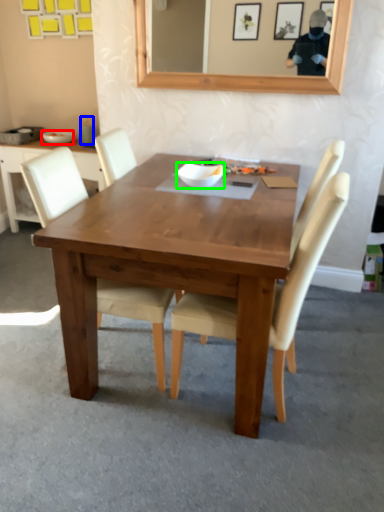
Question: Based on their relative distances, which object is farther from bowl (highlighted by a red box)? Choose from coffee cup (highlighted by a blue box) and bowl (highlighted by a green box).

Choices:
 (A) coffee cup
 (B) bowl

Answer: (B)